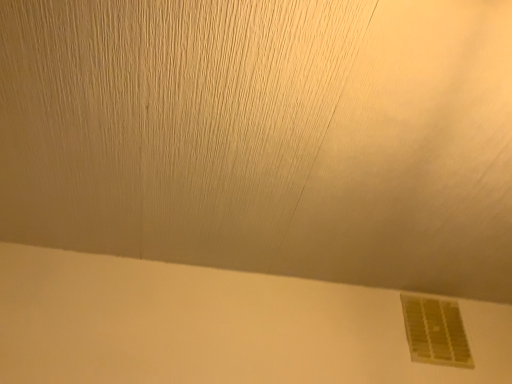
The width and height of the screenshot is (512, 384). In order to click on yellow matte vent at lower right in this screenshot , I will do `click(435, 332)`.

What do you see at coordinates (435, 332) in the screenshot? I see `yellow matte vent at lower right` at bounding box center [435, 332].

The image size is (512, 384). In order to click on yellow matte vent at lower right in this screenshot , I will do `click(435, 332)`.